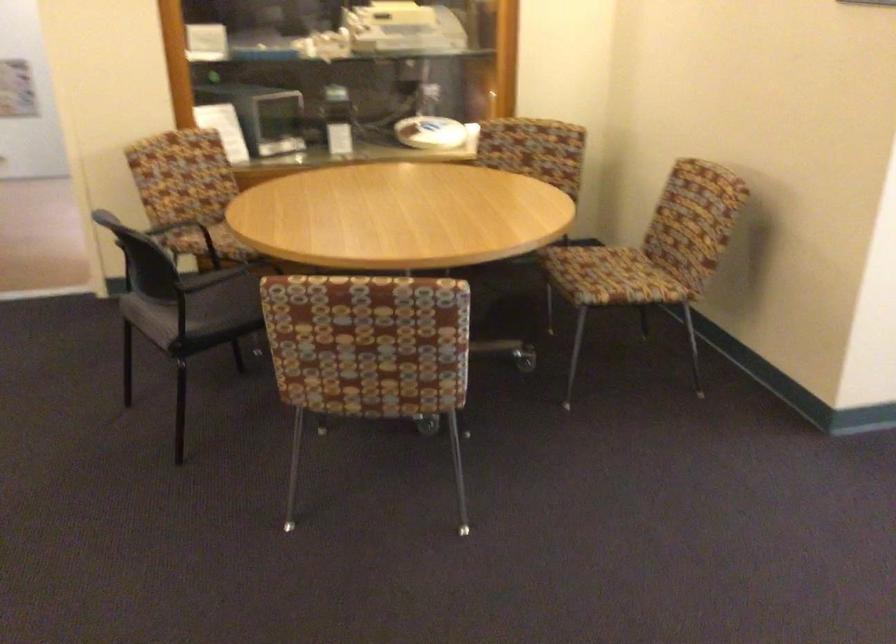
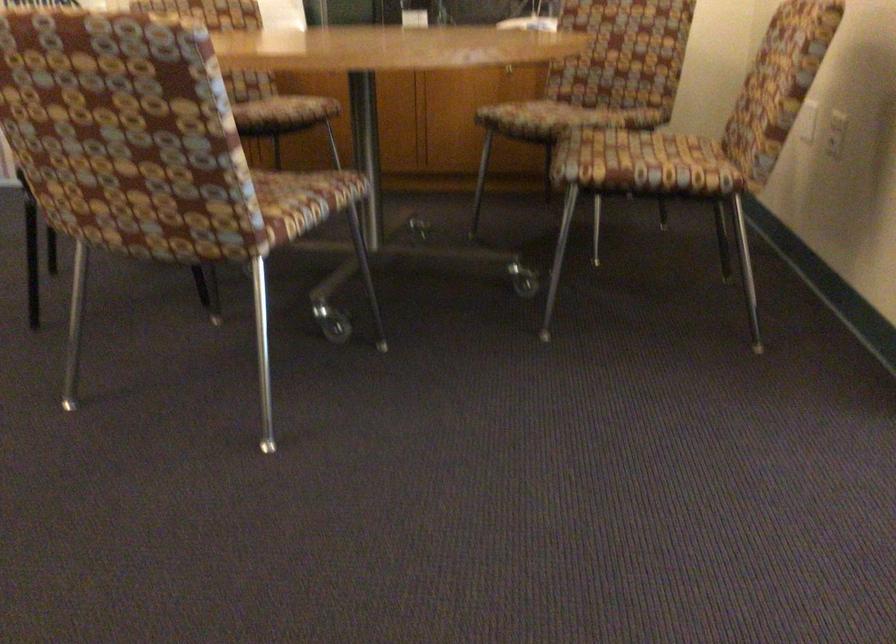
Where in the second image is the point corresponding to point 624,279 from the first image?

(643, 164)